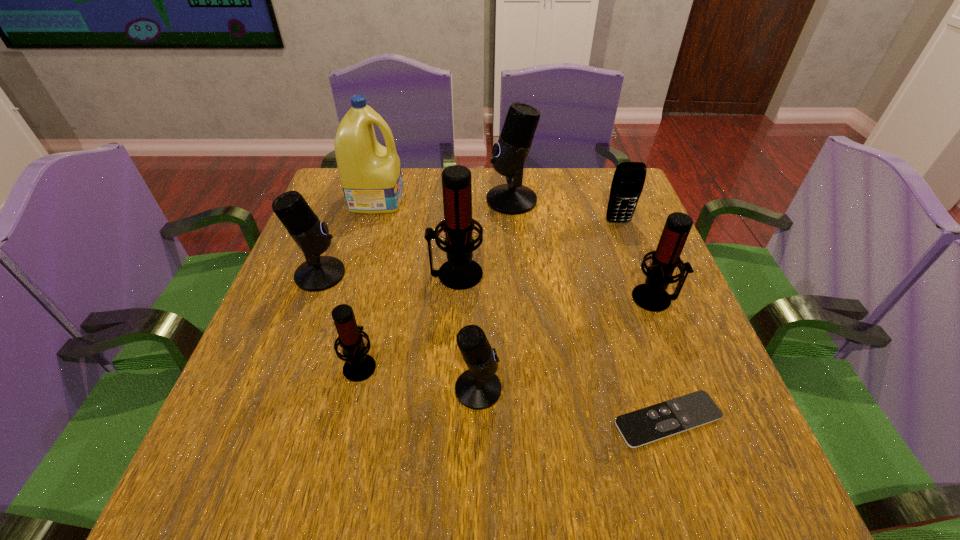
Identify the location of free region located on the front of the rightmost red microphone. The image size is (960, 540). (679, 359).

At what (x,y) coordinates should I click in order to perform the action: click on free point located on the screen of the seventh nearest object. Please return your answer as a coordinate pair (x, y). Looking at the image, I should click on (653, 315).

Locate an element on the screen. vacant point located 0.140m on the left of the leftmost red microphone is located at coordinates (271, 365).

Find the location of a particular element. free space located 0.230m on the stand of the smallest black microphone is located at coordinates (628, 389).

The image size is (960, 540). What are the coordinates of `blank space located 0.070m on the back of the shortest object` in the screenshot? It's located at (648, 361).

Image resolution: width=960 pixels, height=540 pixels. What are the coordinates of `detergent located at the far edge` in the screenshot? It's located at (370, 174).

Identify the location of microphone present at the far edge. The height and width of the screenshot is (540, 960). (510, 153).

Identify the location of detergent situated at the left edge. (370, 174).

The image size is (960, 540). What are the coordinates of `microphone that is at the left edge` in the screenshot? It's located at (318, 273).

The width and height of the screenshot is (960, 540). In order to click on microphone that is at the right edge in this screenshot , I will do `click(651, 296)`.